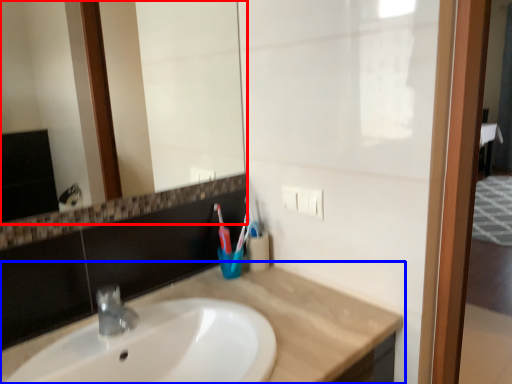
Question: Among these objects, which one is farthest to the camera, mirror (highlighted by a red box) or countertop (highlighted by a blue box)?

Choices:
 (A) mirror
 (B) countertop

Answer: (A)